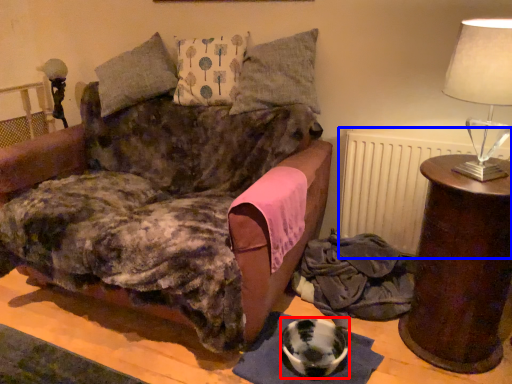
Question: Among these objects, which one is nearest to the camera, bowl (highlighted by a red box) or radiator (highlighted by a blue box)?

Choices:
 (A) bowl
 (B) radiator

Answer: (A)